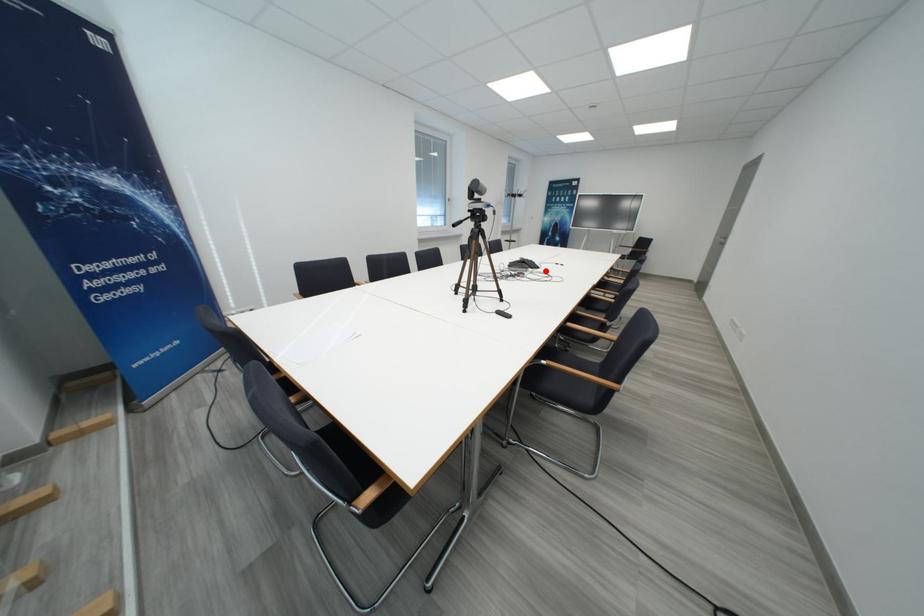
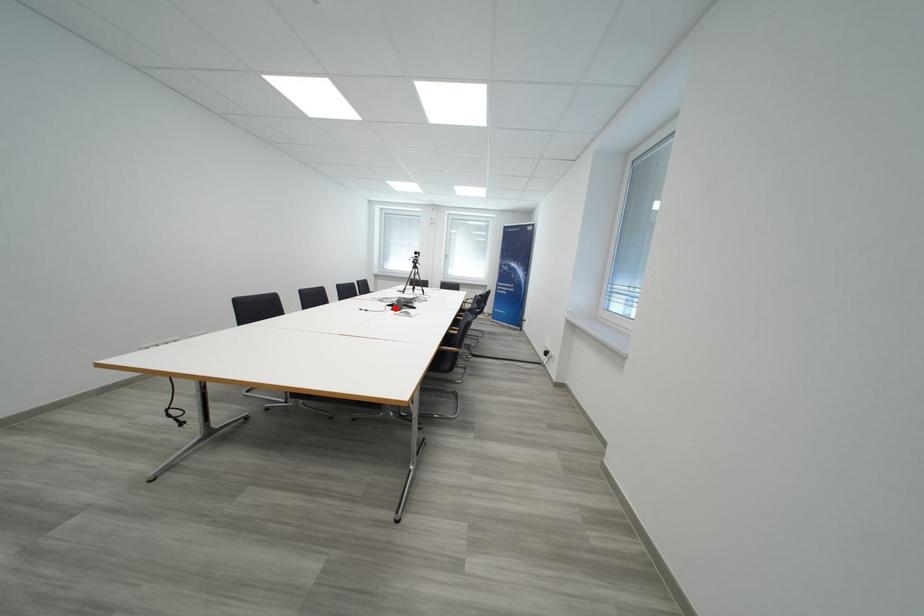
I am providing you with two images of the same scene from different viewpoints. A red point is marked on the first image and another point is marked on the second image. Is the marked point in image1 the same physical position as the marked point in image2?

Yes